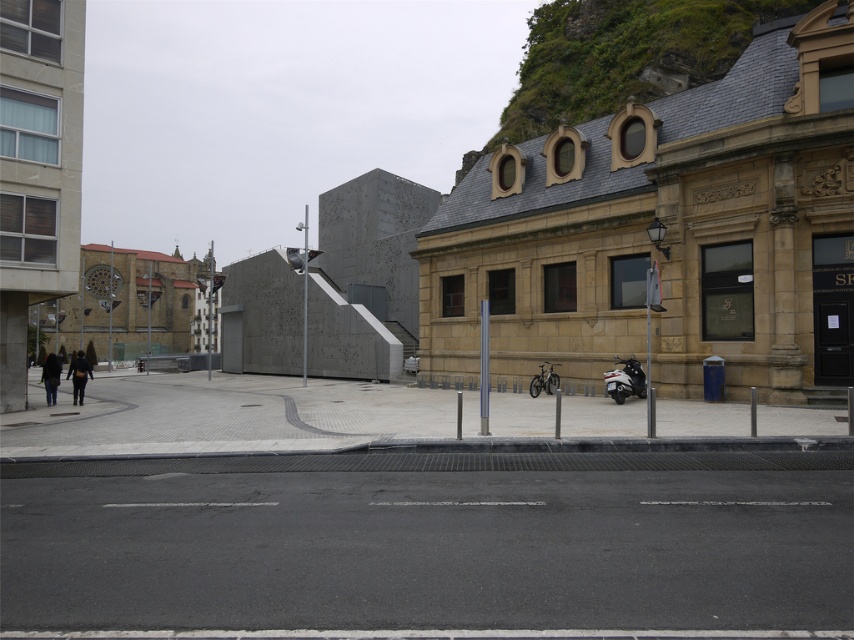
Can you confirm if shiny silver motorcycle at lower right is taller than dark gray coat at left?

Incorrect, shiny silver motorcycle at lower right's height is not larger of dark gray coat at left's.

Does point (623, 369) lie in front of point (42, 372)?

Yes.

Which is behind, point (613, 380) or point (51, 403)?

The point (51, 403) is behind.

Identify the location of shiny silver motorcycle at lower right. click(624, 380).

From the picture: Is dark blue fabric jacket at lower left smaller than shiny silver motorcycle at center?

Incorrect, dark blue fabric jacket at lower left is not smaller in size than shiny silver motorcycle at center.

Is point (67, 371) farther from camera compared to point (557, 378)?

Yes, it is.

You are a GUI agent. You are given a task and a screenshot of the screen. Output one action in this format:
    pyautogui.click(x=<x>, y=<y>)
    Task: Click on the dark blue fabric jacket at lower left
    The image size is (854, 640).
    Given the screenshot: What is the action you would take?
    pyautogui.click(x=79, y=376)

Identify the location of shiny silver motorcycle at lower right. The height and width of the screenshot is (640, 854). (624, 380).

Is point (635, 392) positioned after point (556, 374)?

That is False.

You are a GUI agent. You are given a task and a screenshot of the screen. Output one action in this format:
    pyautogui.click(x=<x>, y=<y>)
    Task: Click on the shiny silver motorcycle at lower right
    This screenshot has width=854, height=640.
    Given the screenshot: What is the action you would take?
    pyautogui.click(x=624, y=380)